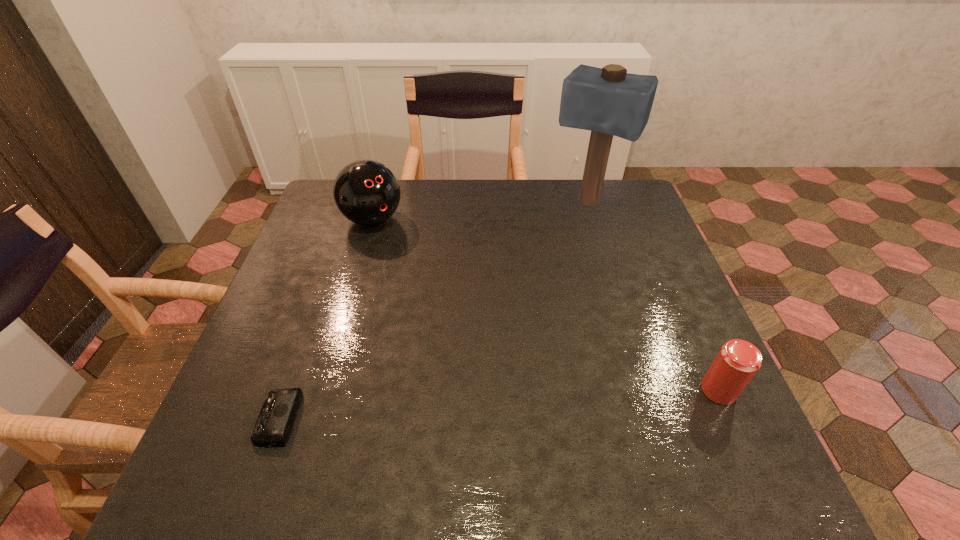
Identify the location of object at the far left corner. (366, 192).

Find the location of `object positioned at the near left corner`. object positioned at the near left corner is located at coordinates (275, 421).

I want to click on object that is at the far right corner, so click(x=608, y=101).

At what (x,y) coordinates should I click in order to perform the action: click on object that is at the near right corner. Please return your answer as a coordinate pair (x, y). Image resolution: width=960 pixels, height=540 pixels. Looking at the image, I should click on (738, 361).

In order to click on free space at the far edge of the desktop in this screenshot , I will do `click(438, 220)`.

This screenshot has height=540, width=960. I want to click on free space at the near edge, so click(x=604, y=399).

The height and width of the screenshot is (540, 960). What are the coordinates of `blank space at the left edge of the desktop` in the screenshot? It's located at (310, 364).

Locate an element on the screen. Image resolution: width=960 pixels, height=540 pixels. vacant space at the right edge of the desktop is located at coordinates (636, 331).

This screenshot has width=960, height=540. I want to click on blank space at the far left corner of the desktop, so click(317, 220).

Identify the location of unoccupied position between the second tallest object and the alarm clock. (325, 319).